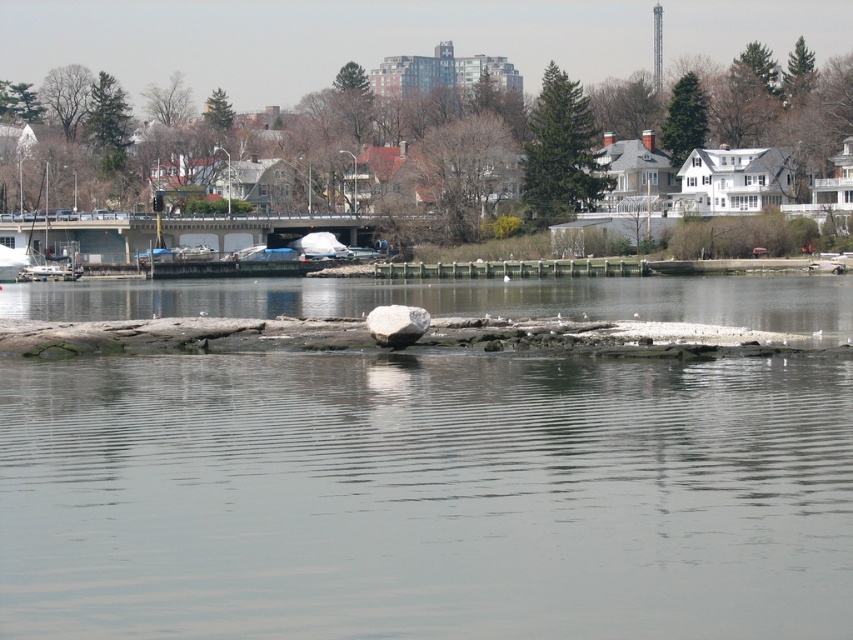
You are standing on the wooden pier and looking toward the center of the image. Which object would you see first between the clear water at center and the gray smooth rock at center?

The clear water at center is in front of the gray smooth rock at center, so you would see the clear water at center first.

You are standing at the point marked by the coordinates point [50,246] in the image. What object is exactly at your current location?

The point [50,246] corresponds to the location of the matte white sailboat at left.